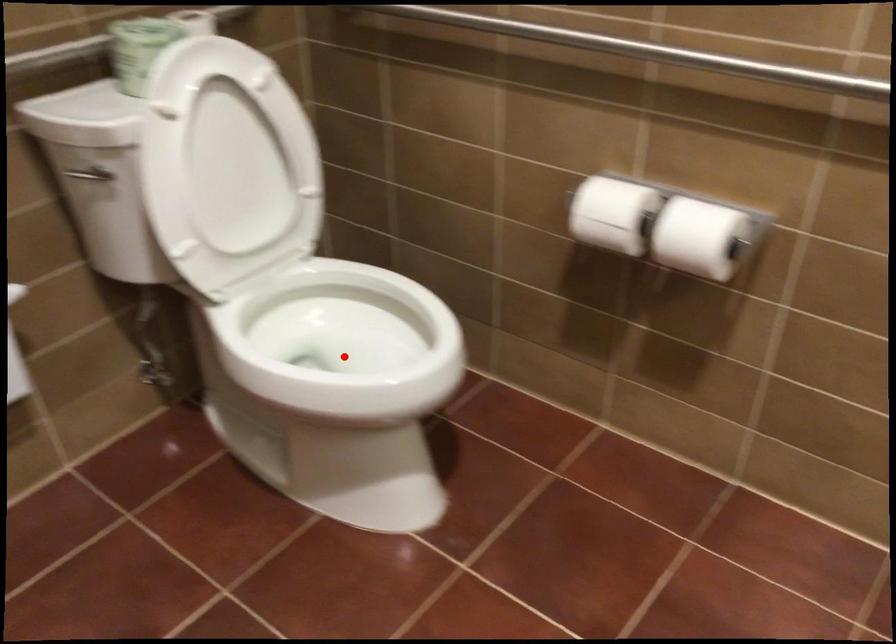
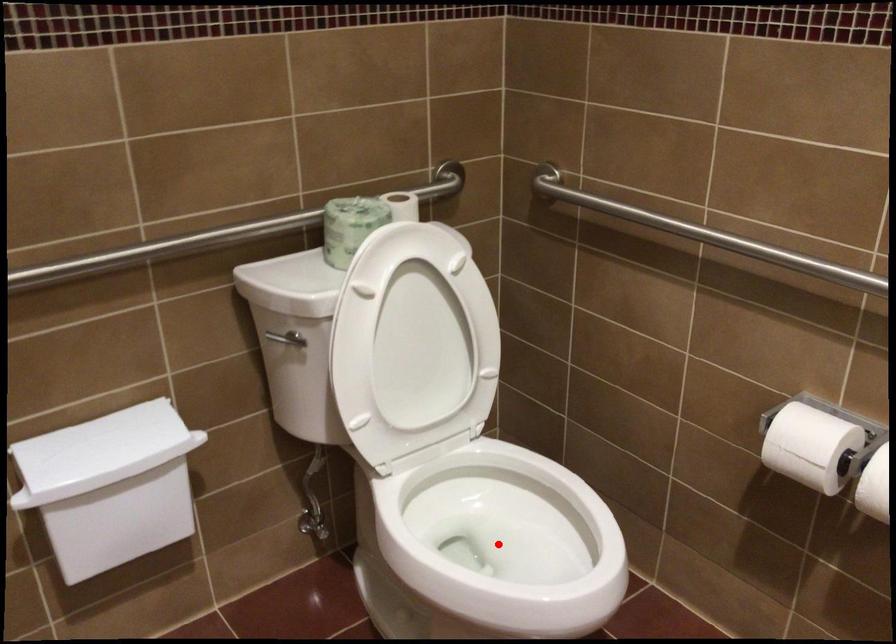
I am providing you with two images of the same scene from different viewpoints. A red point is marked on the first image and another point is marked on the second image. Is the marked point in image1 the same physical position as the marked point in image2?

Yes